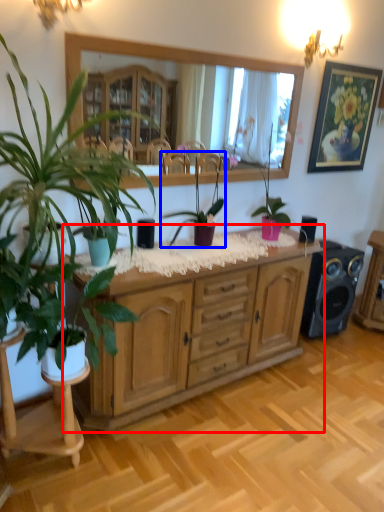
Question: Which point is closer to the camera, cabinetry (highlighted by a red box) or houseplant (highlighted by a blue box)?

Choices:
 (A) cabinetry
 (B) houseplant

Answer: (A)